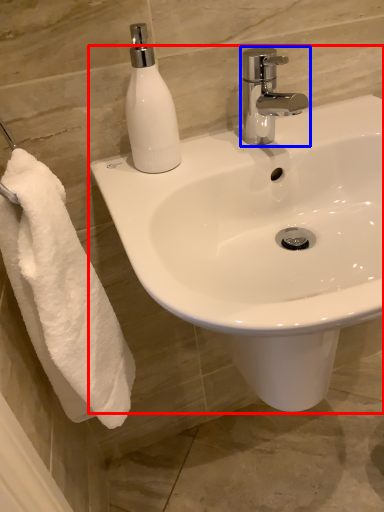
Question: Among these objects, which one is nearest to the camera, sink (highlighted by a red box) or tap (highlighted by a blue box)?

Choices:
 (A) sink
 (B) tap

Answer: (A)